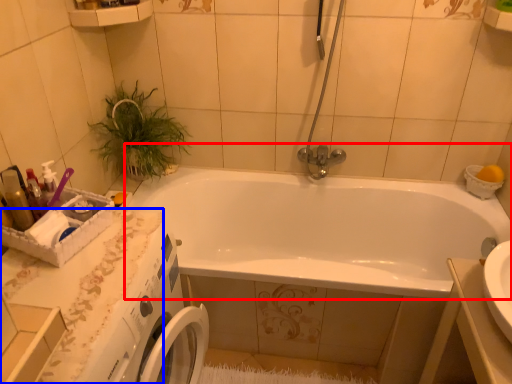
Question: Which object appears farthest to the camera in this image, bathtub (highlighted by a red box) or counter top (highlighted by a blue box)?

Choices:
 (A) bathtub
 (B) counter top

Answer: (A)